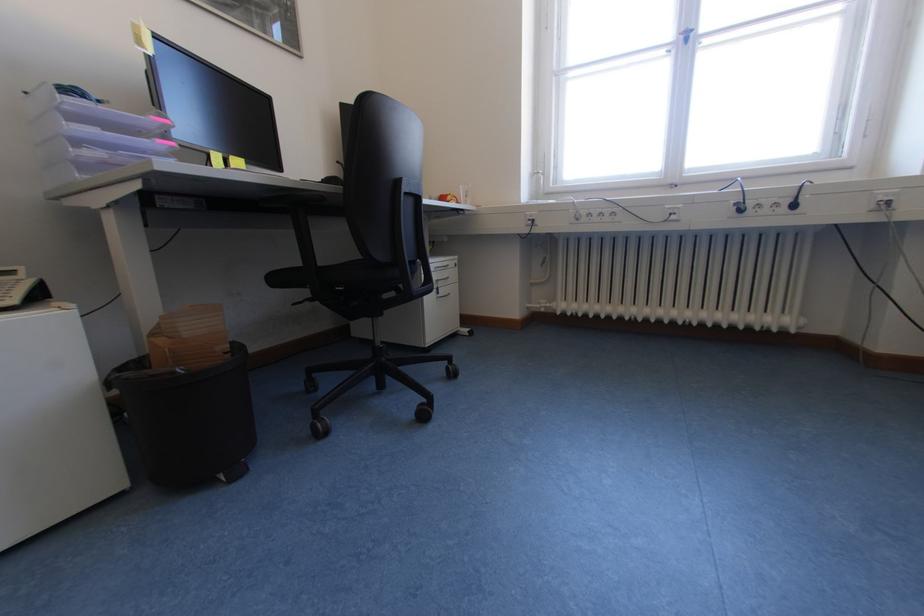
Find where to push the trash can pedal. Please return your answer as a coordinate pair (x, y).

(189, 419)